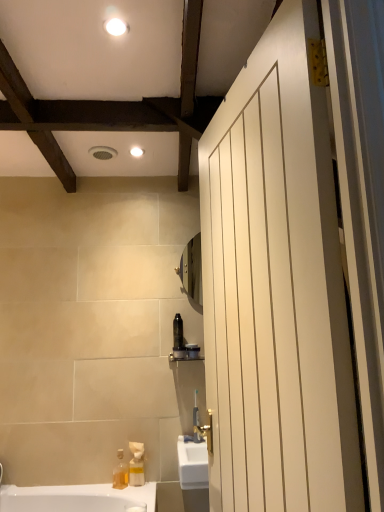
Question: Does white glossy light fixture at upper center, the 2th light fixture viewed from the top, have a greater width compared to white matte door at right?

Choices:
 (A) no
 (B) yes

Answer: (A)

Question: Is white glossy light fixture at upper center, the first light fixture positioned from the back, next to white matte door at right and touching it?

Choices:
 (A) no
 (B) yes

Answer: (A)

Question: From the image's perspective, is white glossy light fixture at upper center, the first light fixture positioned from the back, over white matte door at right?

Choices:
 (A) no
 (B) yes

Answer: (B)

Question: Considering the relative positions of white glossy light fixture at upper center, the 2th light fixture viewed from the top, and white matte door at right in the image provided, is white glossy light fixture at upper center, the 2th light fixture viewed from the top, to the right of white matte door at right from the viewer's perspective?

Choices:
 (A) yes
 (B) no

Answer: (B)

Question: From a real-world perspective, is white glossy light fixture at upper center, which is the 1th light fixture in bottom-to-top order, below white matte door at right?

Choices:
 (A) yes
 (B) no

Answer: (B)

Question: Does white glossy light fixture at upper center, which is the 1th light fixture in bottom-to-top order, turn towards white matte door at right?

Choices:
 (A) no
 (B) yes

Answer: (A)

Question: Does white matte door at right have a larger size compared to matte black toothbrush at center?

Choices:
 (A) no
 (B) yes

Answer: (B)

Question: Would you say matte black toothbrush at center is part of white matte door at right's contents?

Choices:
 (A) yes
 (B) no

Answer: (B)

Question: From the image's perspective, would you say white matte door at right is positioned over matte black toothbrush at center?

Choices:
 (A) yes
 (B) no

Answer: (A)

Question: From the image's perspective, is white matte door at right under matte black toothbrush at center?

Choices:
 (A) no
 (B) yes

Answer: (A)

Question: Is white matte door at right next to matte black toothbrush at center?

Choices:
 (A) yes
 (B) no

Answer: (B)

Question: Does white matte door at right come behind matte black toothbrush at center?

Choices:
 (A) yes
 (B) no

Answer: (B)

Question: Is white matte door at right not close to white glossy light fixture at upper center, the 2th light fixture viewed from the top?

Choices:
 (A) no
 (B) yes

Answer: (B)